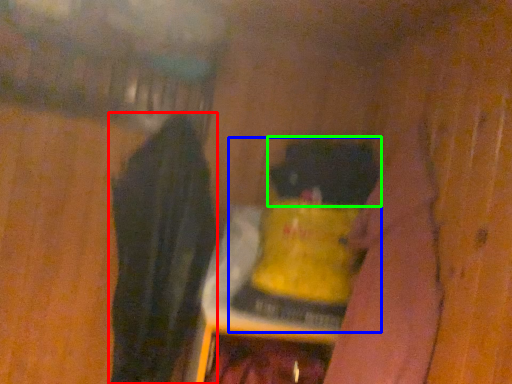
Question: Considering the real-world distances, which object is closest to clothing (highlighted by a red box)? bottle (highlighted by a blue box) or animal (highlighted by a green box).

Choices:
 (A) bottle
 (B) animal

Answer: (A)